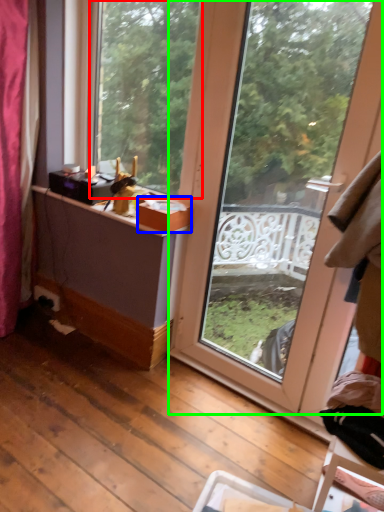
Question: Based on their relative distances, which object is nearer to window (highlighted by a red box)? Choose from box (highlighted by a blue box) and window (highlighted by a green box).

Choices:
 (A) box
 (B) window

Answer: (B)